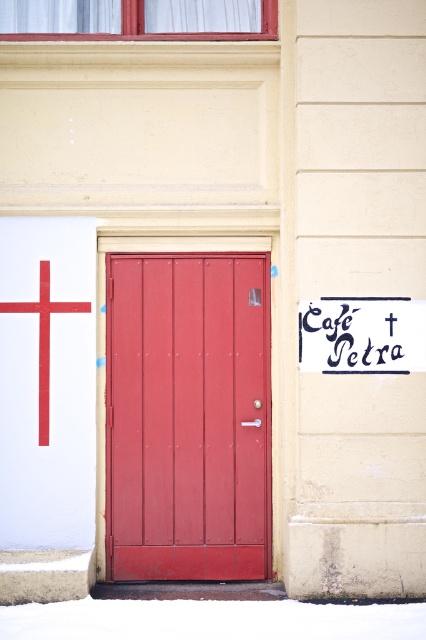
Measure the distance between white paper café petra sign at lower right and white matte cross at upper left.

A distance of 5.14 feet exists between white paper café petra sign at lower right and white matte cross at upper left.

Does white paper café petra sign at lower right appear under white matte cross at upper left?

Actually, white paper café petra sign at lower right is above white matte cross at upper left.

What do you see at coordinates (362, 336) in the screenshot? Image resolution: width=426 pixels, height=640 pixels. I see `white paper café petra sign at lower right` at bounding box center [362, 336].

Identify the location of white paper café petra sign at lower right. This screenshot has height=640, width=426. (362, 336).

Can you confirm if matte wood door at center is positioned to the left of white matte cross at upper left?

In fact, matte wood door at center is to the right of white matte cross at upper left.

Who is more forward, (x=195, y=522) or (x=43, y=358)?

Positioned in front is point (x=43, y=358).

This screenshot has height=640, width=426. Find the location of `matte wood door at center`. matte wood door at center is located at coordinates (187, 417).

Between matte wood door at center and white paper café petra sign at lower right, which one appears on the left side from the viewer's perspective?

Positioned to the left is matte wood door at center.

Image resolution: width=426 pixels, height=640 pixels. I want to click on matte wood door at center, so click(187, 417).

You are a GUI agent. You are given a task and a screenshot of the screen. Output one action in this format:
    pyautogui.click(x=<x>, y=<y>)
    Task: Click on the matte wood door at center
    This screenshot has width=426, height=640.
    Given the screenshot: What is the action you would take?
    pyautogui.click(x=187, y=417)